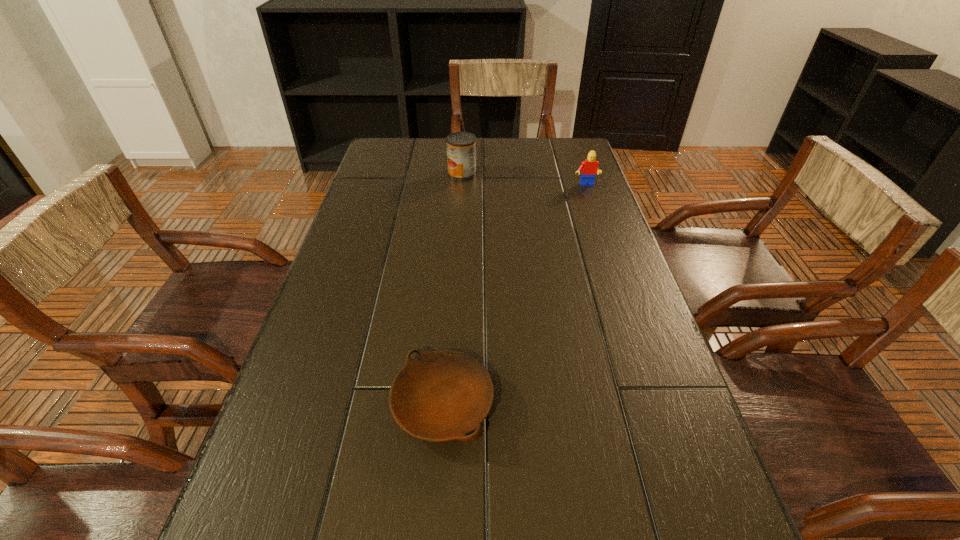
Locate an element on the screen. This screenshot has width=960, height=540. can is located at coordinates (461, 146).

I want to click on the second nearest object, so click(x=589, y=168).

Locate an element on the screen. Lego is located at coordinates (589, 168).

Where is `plate`? plate is located at coordinates (444, 395).

In order to click on the shortest object in this screenshot , I will do `click(444, 395)`.

This screenshot has width=960, height=540. I want to click on vacant region located 0.100m on the front of the can, so click(461, 198).

This screenshot has height=540, width=960. I want to click on vacant area situated on the front-facing side of the Lego, so click(591, 202).

Identify the location of vacant space situated on the right of the shortest object. The image size is (960, 540). (543, 404).

Where is `object at the far edge`? The image size is (960, 540). object at the far edge is located at coordinates (461, 146).

You are a GUI agent. You are given a task and a screenshot of the screen. Output one action in this format:
    pyautogui.click(x=<x>, y=<y>)
    Task: Click on the object situated at the right edge
    
    Given the screenshot: What is the action you would take?
    pyautogui.click(x=589, y=168)